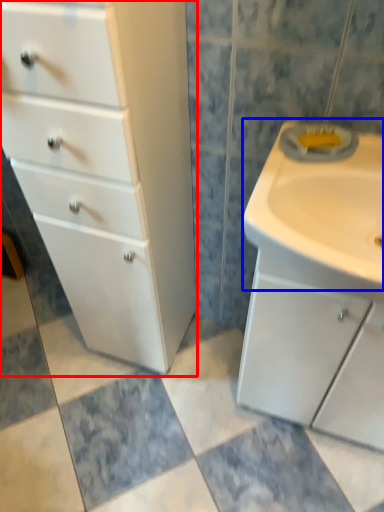
Question: Which object appears closest to the camera in this image, chest of drawers (highlighted by a red box) or sink (highlighted by a blue box)?

Choices:
 (A) chest of drawers
 (B) sink

Answer: (A)